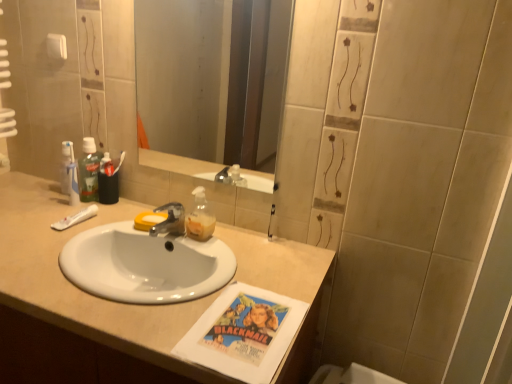
Identify the location of free location above white glossy sink at center (from a real-world perspective). (113, 227).